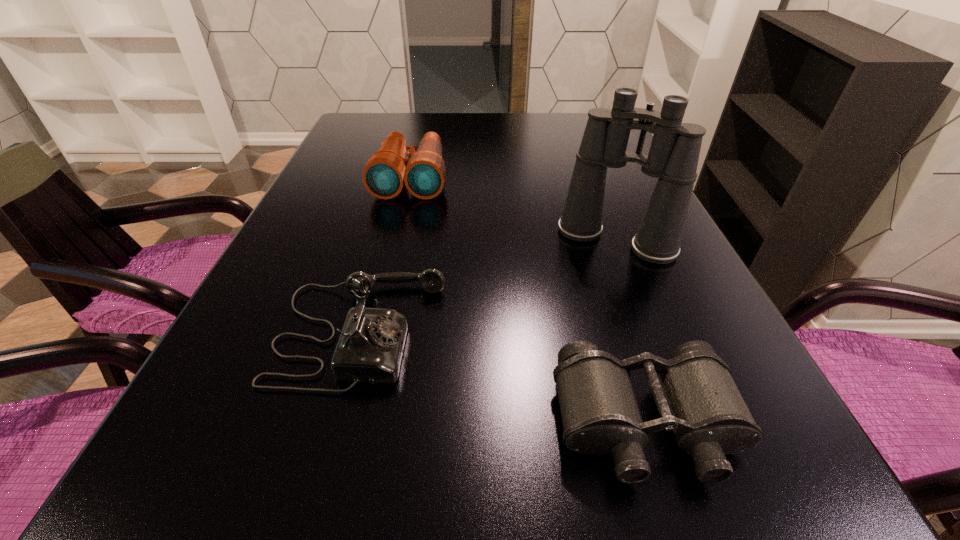
Where is `vacant region between the third nearest object and the farthest binoculars`? vacant region between the third nearest object and the farthest binoculars is located at coordinates (514, 209).

Find the location of a particular element. This screenshot has height=540, width=960. object that stands as the second closest to the second nearest binoculars is located at coordinates tap(696, 397).

This screenshot has width=960, height=540. Find the location of `object that ranks as the closest to the tallest object`. object that ranks as the closest to the tallest object is located at coordinates (369, 350).

Select which binoculars is the second closest to the farthest object. Please provide its 2D coordinates. Your answer should be formatted as a tuple, i.e. [(x, y)], where the tuple contains the x and y coordinates of a point satisfying the conditions above.

[(696, 397)]

Identify which binoculars is located as the second nearest to the shortest object. Please provide its 2D coordinates. Your answer should be formatted as a tuple, i.e. [(x, y)], where the tuple contains the x and y coordinates of a point satisfying the conditions above.

[(423, 172)]

At what (x,y) coordinates should I click in order to perform the action: click on free space in the image that satisfies the following two spatial constraints: 1. through the lenses of the second tallest binoculars; 2. on the right side of the second farthest binoculars. Please return your answer as a coordinate pair (x, y). Looking at the image, I should click on (396, 240).

Locate an element on the screen. The image size is (960, 540). free spot that satisfies the following two spatial constraints: 1. through the lenses of the leftmost binoculars; 2. on the left side of the tallest object is located at coordinates (396, 240).

The width and height of the screenshot is (960, 540). I want to click on free space that satisfies the following two spatial constraints: 1. through the lenses of the leftmost binoculars; 2. on the dial of the telephone, so click(374, 331).

Locate an element on the screen. This screenshot has width=960, height=540. vacant space that satisfies the following two spatial constraints: 1. through the lenses of the farthest object; 2. on the dial of the telephone is located at coordinates (374, 331).